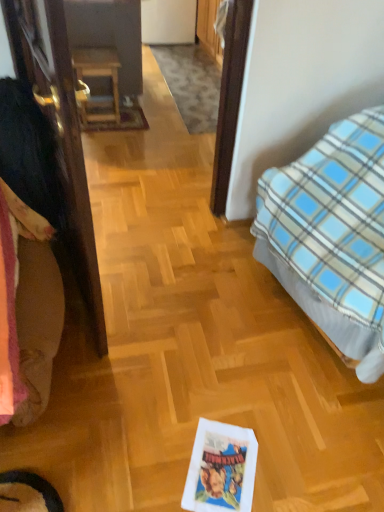
Identify the location of vacant point to the right of fluffy beige blanket at left. (148, 381).